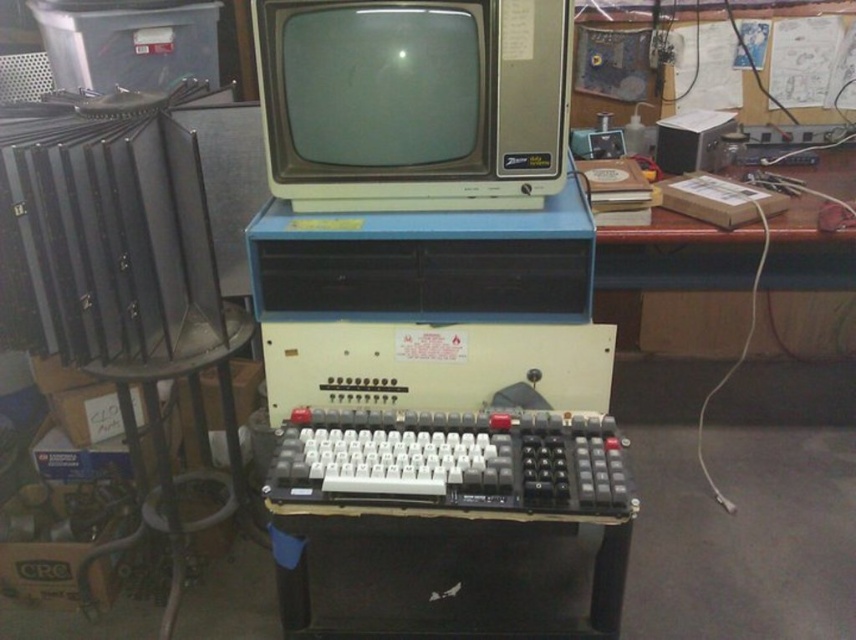
You are setting up a display for a tech exhibition and need to place the matte gray crt monitor at center and the white plastic keyboard at center on a table. Given that the monitor is larger, will the keyboard fit to the right of the monitor without overlapping?

The matte gray crt monitor at center is larger than the white plastic keyboard at center, so there should be enough space to place the keyboard to the right of the monitor without overlapping, provided the table is sufficiently wide.

You are standing in the workshop and see two points marked in the image. One is at point (470, 113) and the other at point (317, 506). If you want to reach the point that is closer to you, which coordinate should you go to?

Point (317, 506) is closer to you, so you should go to that coordinate.

You are setting up a vintage computer display. The setup requires placing the matte gray crt monitor at center and the white plastic keyboard at center in a specific arrangement. According to the image, which object is placed above the other?

The matte gray crt monitor at center is positioned over the white plastic keyboard at center, meaning the monitor is above the keyboard.